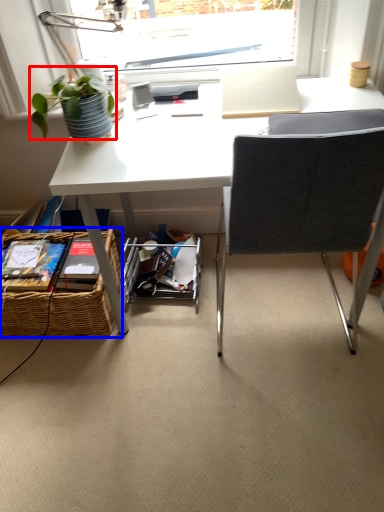
Question: Which point is further to the camera, plant (highlighted by a red box) or picnic basket (highlighted by a blue box)?

Choices:
 (A) plant
 (B) picnic basket

Answer: (B)